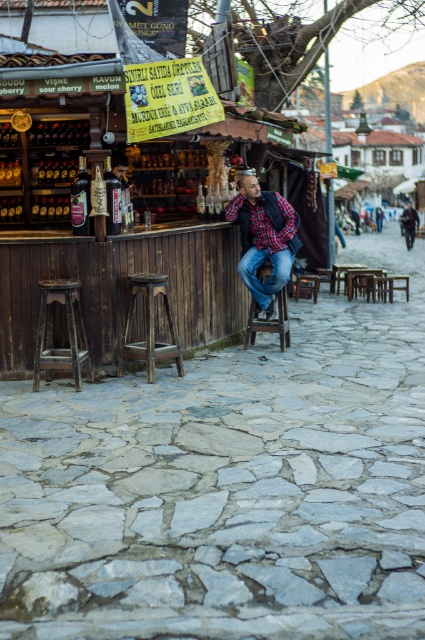
Is point (158, 348) farther from viewer compared to point (309, 284)?

No.

Describe the element at coordinates (150, 326) in the screenshot. I see `wooden bar stool at center` at that location.

Locate an element on the screen. The height and width of the screenshot is (640, 425). wooden bar stool at center is located at coordinates (150, 326).

Is plaid shirt at center to the left of wooden bar stool at lower left from the viewer's perspective?

Incorrect, plaid shirt at center is not on the left side of wooden bar stool at lower left.

Can you confirm if plaid shirt at center is bigger than wooden bar stool at lower left?

Indeed, plaid shirt at center has a larger size compared to wooden bar stool at lower left.

The height and width of the screenshot is (640, 425). Describe the element at coordinates (263, 237) in the screenshot. I see `plaid shirt at center` at that location.

This screenshot has height=640, width=425. Find the location of `plaid shirt at center`. plaid shirt at center is located at coordinates (263, 237).

Who is more distant from viewer, (271,308) or (405,228)?

Point (405,228)

Does plaid shirt at center appear under dark blue jeans at center?

Correct, plaid shirt at center is located below dark blue jeans at center.

Between point (232, 209) and point (408, 243), which one is positioned behind?

Point (408, 243)

Locate an element on the screen. Image resolution: width=425 pixels, height=640 pixels. plaid shirt at center is located at coordinates (263, 237).